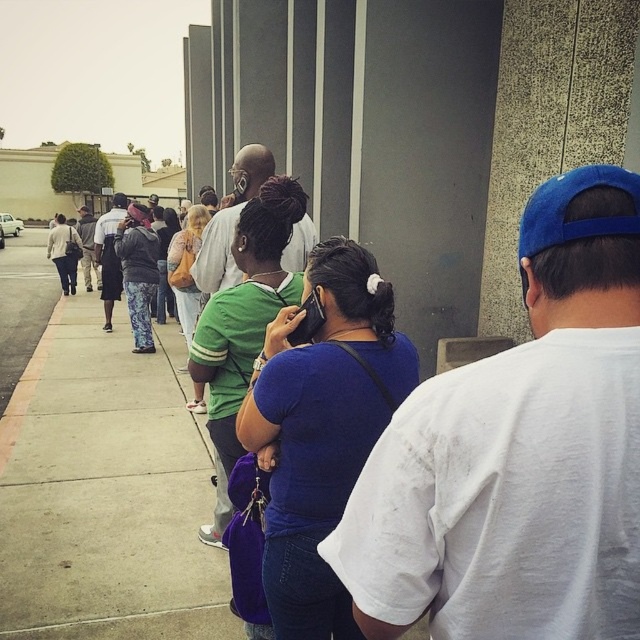
Question: Which point appears closest to the camera in this image?

Choices:
 (A) (241, 381)
 (B) (36, 349)
 (C) (616, 196)
 (D) (349, 624)

Answer: (C)

Question: Can you confirm if white cotton shirt at center is positioned to the left of matte black jacket at left?

Choices:
 (A) yes
 (B) no

Answer: (B)

Question: Does concrete sidewalk at lower left appear under matte black jacket at left?

Choices:
 (A) no
 (B) yes

Answer: (B)

Question: Which object is positioned farthest from the concrete sidewalk at lower left?

Choices:
 (A) green matte shirt at center
 (B) matte black jacket at left

Answer: (B)

Question: Considering the relative positions of concrete sidewalk at lower left and matte black jacket at left in the image provided, where is concrete sidewalk at lower left located with respect to matte black jacket at left?

Choices:
 (A) above
 (B) below

Answer: (B)

Question: Among these objects, which one is farthest from the camera?

Choices:
 (A) white cotton shirt at center
 (B) concrete sidewalk at lower left

Answer: (B)